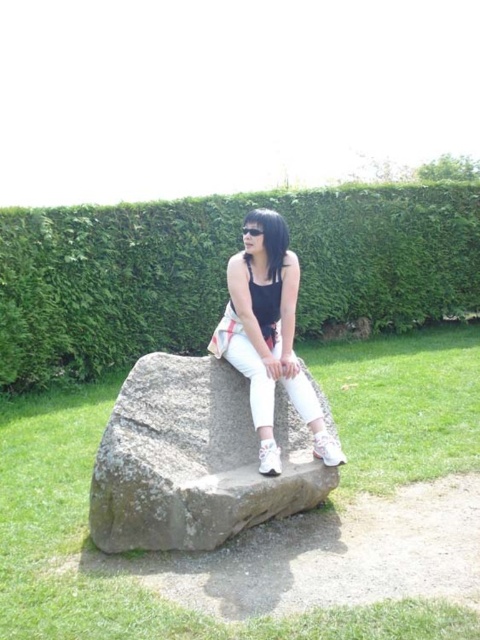
Based on the photo, you are a photographer trying to capture a closeup of the transparent plastic goggles at center. However, the matte black tank top at center is blocking your view. Can you determine which object you need to move slightly to get a clear shot?

The matte black tank top at center is smaller than transparent plastic goggles at center. To get a clear shot of the transparent plastic goggles at center, you need to move the smaller matte black tank top at center out of the way since it is blocking the larger goggles.

Based on the photo, you are a photographer aiming to capture the gray rough stone at center in the image. The camera is positioned at the point with coordinates point [193,460]. Can you determine if the gray rough stone at center will be in the center of your photo?

The point [193,460] marks the gray rough stone at center, so yes, the gray rough stone at center will be in the center of your photo.

You are a photographer trying to capture the matte black tank top at center and the transparent plastic goggles at center in a single shot. Since both are at the center, will the goggles be visible through the tank top?

The matte black tank top at center is in front of transparent plastic goggles at center, so the goggles will not be visible through the tank top because the tank top is blocking the view.